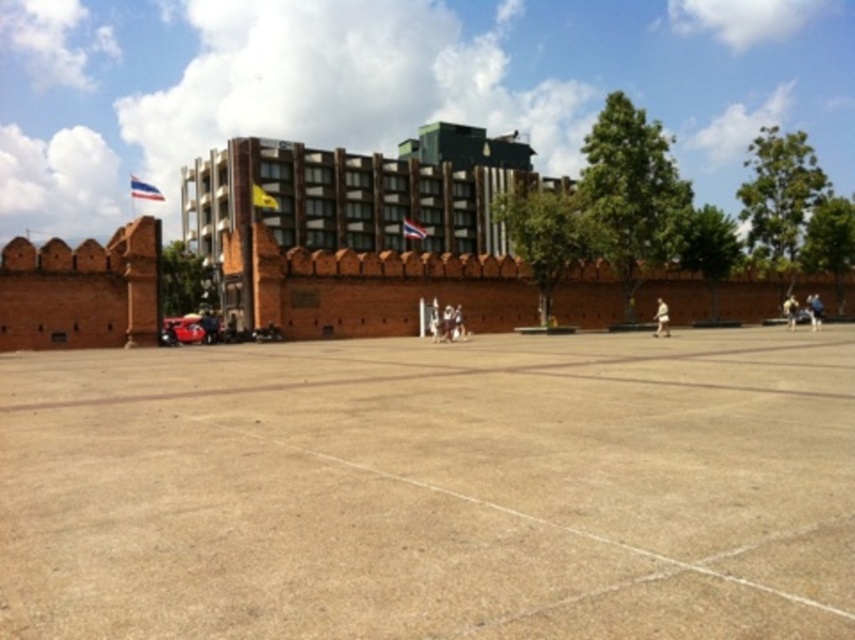
Does brick wall at left appear under blue fabric person at center?

Incorrect, brick wall at left is not positioned below blue fabric person at center.

Is brick wall at left wider than blue fabric person at center?

In fact, brick wall at left might be narrower than blue fabric person at center.

Where is `brick wall at left`? Image resolution: width=855 pixels, height=640 pixels. brick wall at left is located at coordinates (81, 291).

Is point (376, 256) farther from viewer compared to point (463, 337)?

Yes, point (376, 256) is behind point (463, 337).

Is brick wall at center positioned in front of light brown leather jacket at center?

No, it is not.

Image resolution: width=855 pixels, height=640 pixels. Find the location of `brick wall at center`. brick wall at center is located at coordinates (379, 289).

Measure the distance between brown concrete plaza at center and camera.

A distance of 4.22 meters exists between brown concrete plaza at center and camera.

Does brown concrete plaza at center have a smaller size compared to yellow fabric flag at center?

Correct, brown concrete plaza at center occupies less space than yellow fabric flag at center.

I want to click on brown concrete plaza at center, so click(x=432, y=488).